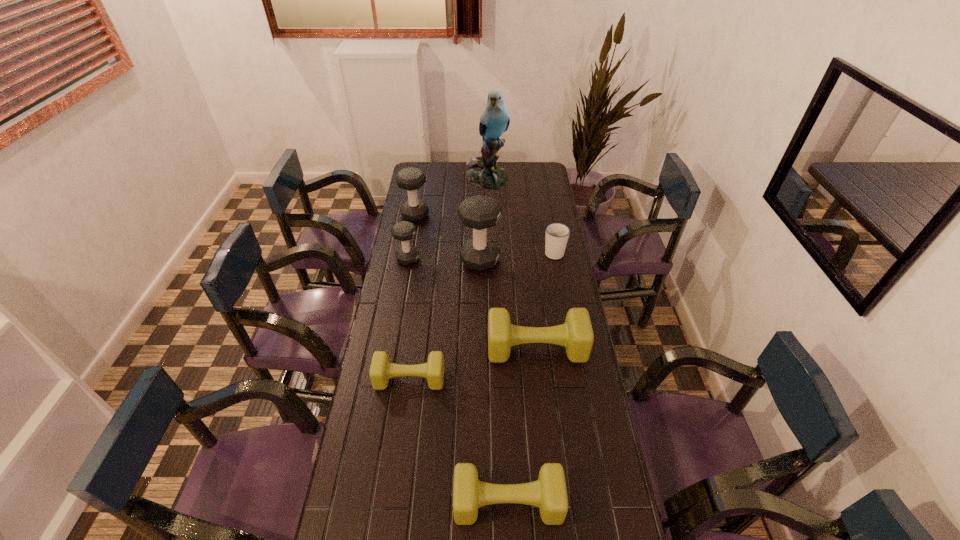
The image size is (960, 540). I want to click on dumbbell that stands as the third closest to the farthest object, so click(x=404, y=231).

Where is `the third closest dumbbell to the smallest gray dumbbell`? Image resolution: width=960 pixels, height=540 pixels. the third closest dumbbell to the smallest gray dumbbell is located at coordinates (576, 335).

The width and height of the screenshot is (960, 540). I want to click on the second closest gray dumbbell to the smallest gray dumbbell, so click(x=410, y=179).

What are the coordinates of `gray dumbbell that is the second closest one to the smallest gray dumbbell` in the screenshot? It's located at (410, 179).

Choose which olive dumbbell is the nearest neighbor to the fifth tallest dumbbell. Please provide its 2D coordinates. Your answer should be formatted as a tuple, i.e. [(x, y)], where the tuple contains the x and y coordinates of a point satisfying the conditions above.

[(381, 370)]

Locate which olive dumbbell is the second closest to the nearest dumbbell. Please provide its 2D coordinates. Your answer should be formatted as a tuple, i.e. [(x, y)], where the tuple contains the x and y coordinates of a point satisfying the conditions above.

[(576, 335)]

You are a GUI agent. You are given a task and a screenshot of the screen. Output one action in this format:
    pyautogui.click(x=<x>, y=<y>)
    Task: Click on the vacant space that satisfies the following two spatial constraints: 1. on the front side of the second shortest dumbbell; 2. on the left side of the smallest gray dumbbell
    This screenshot has height=540, width=960.
    Given the screenshot: What is the action you would take?
    pyautogui.click(x=365, y=503)

The height and width of the screenshot is (540, 960). Identify the location of free spot that satisfies the following two spatial constraints: 1. on the front side of the second tallest dumbbell; 2. on the right side of the second shortest dumbbell. pyautogui.click(x=364, y=503).